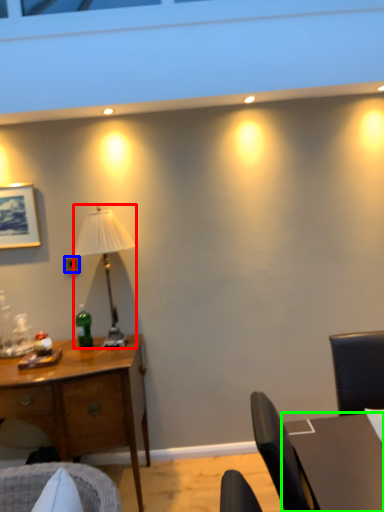
Question: Based on their relative distances, which object is farther from lamp (highlighted by a red box)? Choose from power outlet (highlighted by a blue box) and table (highlighted by a green box).

Choices:
 (A) power outlet
 (B) table

Answer: (B)